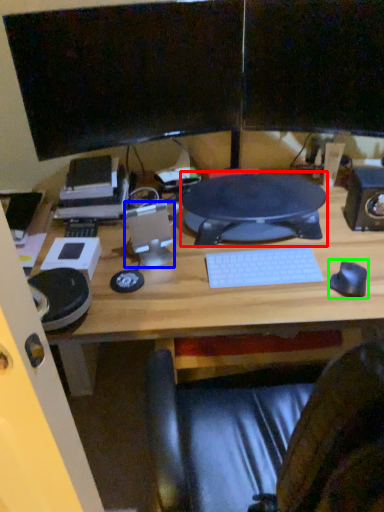
Question: Which is nearer to the sit (highlighted by a red box)? speaker (highlighted by a blue box) or mouse (highlighted by a green box).

Choices:
 (A) speaker
 (B) mouse

Answer: (A)